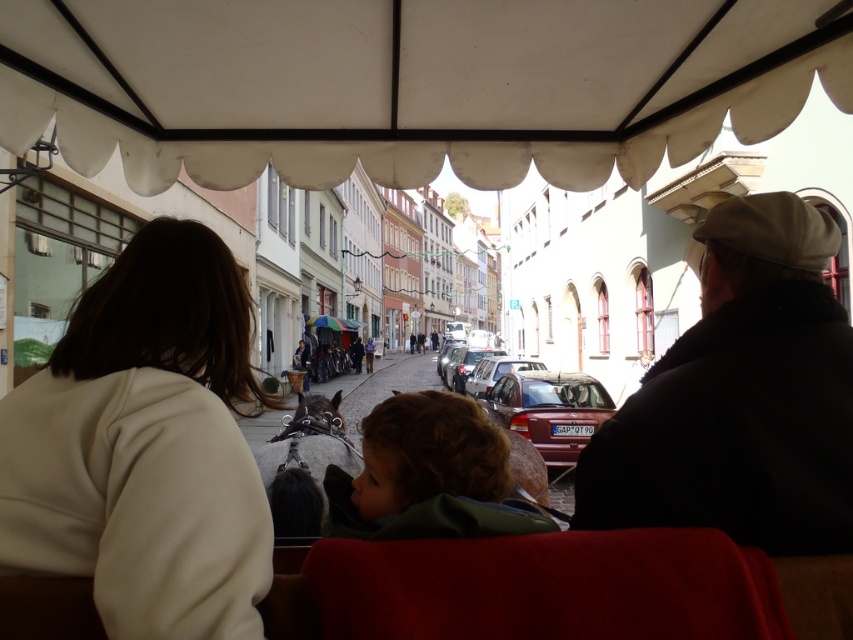
Question: Is brown fuzzy hair at center behind metallic silver car at center?

Choices:
 (A) no
 (B) yes

Answer: (A)

Question: Can you confirm if shiny red car at center is wider than metallic silver car at center?

Choices:
 (A) yes
 (B) no

Answer: (A)

Question: Which point is closer to the camera?

Choices:
 (A) beige fleece jacket at left
 (B) metallic silver car at center

Answer: (A)

Question: Does shiny red car at center come in front of satin silver car at center?

Choices:
 (A) yes
 (B) no

Answer: (A)

Question: Which of the following is the closest to the observer?

Choices:
 (A) white fabric canopy at upper center
 (B) satin silver car at center

Answer: (A)

Question: Which of the following is the closest to the observer?

Choices:
 (A) white fabric canopy at upper center
 (B) satin silver car at center
 (C) dark brown leather coach at center
 (D) metallic silver car at center

Answer: (C)